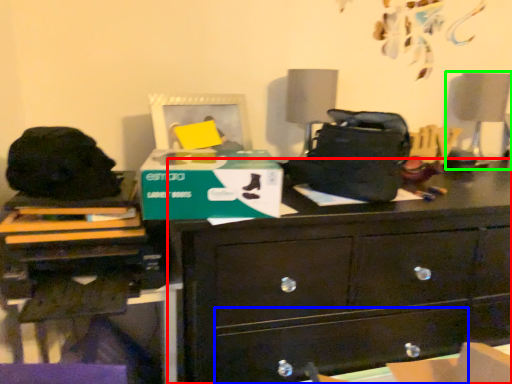
Question: Which is nearer to the chest of drawers (highlighted by a red box)? drawer (highlighted by a blue box) or swivel chair (highlighted by a green box).

Choices:
 (A) drawer
 (B) swivel chair

Answer: (A)